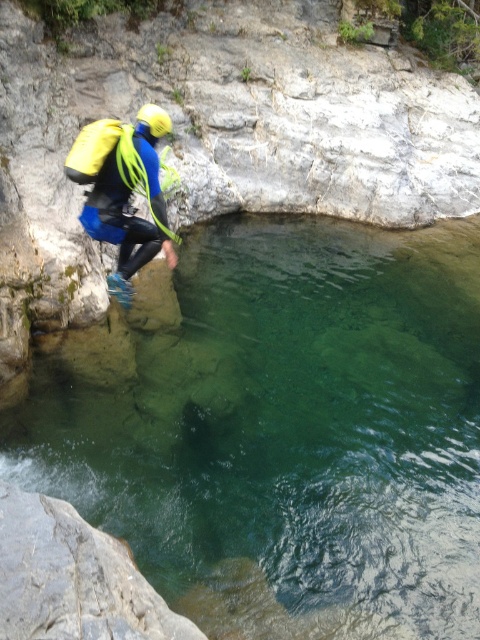
Does clear water at center appear on the right side of yellow neoprene suit at left?

Yes, clear water at center is to the right of yellow neoprene suit at left.

Looking at this image, is clear water at center further to camera compared to yellow neoprene suit at left?

No, clear water at center is in front of yellow neoprene suit at left.

Does point (142, 352) come behind point (147, 177)?

Yes, point (142, 352) is farther from viewer.

In order to click on clear water at center in this screenshot , I will do `click(280, 428)`.

Is clear water at center shorter than gray rough rock at lower left?

In fact, clear water at center may be taller than gray rough rock at lower left.

Can you confirm if clear water at center is positioned to the right of gray rough rock at lower left?

Yes, clear water at center is to the right of gray rough rock at lower left.

Is point (21, 465) positioned after point (41, 522)?

Yes, it is.

At what (x,y) coordinates should I click in order to perform the action: click on clear water at center. Please return your answer as a coordinate pair (x, y). Looking at the image, I should click on (280, 428).

Between point (44, 534) and point (162, 113), which one is positioned behind?

The point (162, 113) is more distant.

You are a GUI agent. You are given a task and a screenshot of the screen. Output one action in this format:
    pyautogui.click(x=<x>, y=<y>)
    Task: Click on the gray rough rock at lower left
    The height and width of the screenshot is (640, 480).
    Given the screenshot: What is the action you would take?
    pyautogui.click(x=72, y=579)